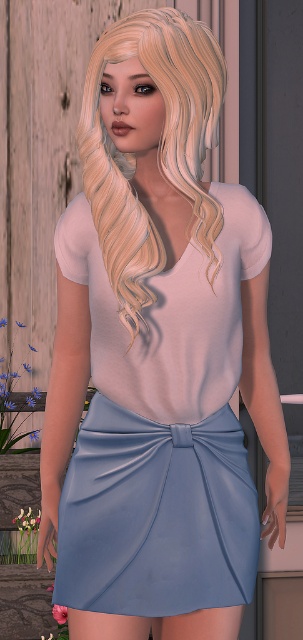
Question: Is satin blue skirt at center behind blondehair at center?

Choices:
 (A) yes
 (B) no

Answer: (A)

Question: Can you confirm if satin blue skirt at center is positioned above blondehair at center?

Choices:
 (A) no
 (B) yes

Answer: (A)

Question: Is satin blue skirt at center thinner than blondehair at center?

Choices:
 (A) yes
 (B) no

Answer: (B)

Question: Which of the following is the closest to the observer?

Choices:
 (A) (173, 499)
 (B) (163, 64)

Answer: (B)

Question: Which object is closer to the camera taking this photo?

Choices:
 (A) satin blue skirt at center
 (B) blondehair at center

Answer: (B)